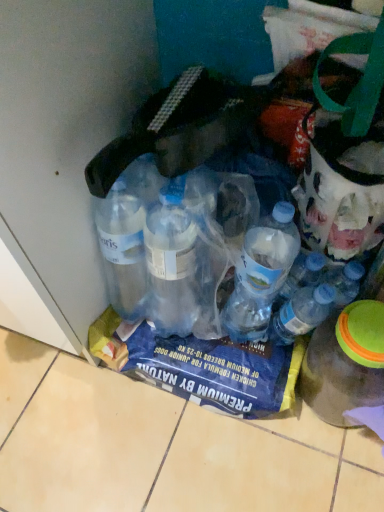
Question: From a real-world perspective, is translucent plastic bottle at center, placed as the 2th bottle when sorted from left to right, under transparent plastic bottle at lower right, which is the 1th bottle from right to left?

Choices:
 (A) yes
 (B) no

Answer: (B)

Question: Is transparent plastic bottle at lower right, arranged as the 3th bottle when viewed from the left, completely or partially inside translucent plastic bottle at center, which is counted as the second bottle, starting from the right?

Choices:
 (A) no
 (B) yes

Answer: (A)

Question: Is translucent plastic bottle at center, placed as the 2th bottle when sorted from left to right, smaller than transparent plastic bottle at lower right, which is the 1th bottle from right to left?

Choices:
 (A) no
 (B) yes

Answer: (B)

Question: Does translucent plastic bottle at center, which is counted as the second bottle, starting from the right, have a greater width compared to transparent plastic bottle at lower right, which is the 1th bottle from right to left?

Choices:
 (A) yes
 (B) no

Answer: (B)

Question: Considering the relative sizes of translucent plastic bottle at center, placed as the 2th bottle when sorted from left to right, and transparent plastic bottle at lower right, which is the 1th bottle from right to left, in the image provided, is translucent plastic bottle at center, placed as the 2th bottle when sorted from left to right, thinner than transparent plastic bottle at lower right, which is the 1th bottle from right to left,?

Choices:
 (A) yes
 (B) no

Answer: (A)

Question: From a real-world perspective, is transparent plastic bottle at lower right, arranged as the 3th bottle when viewed from the left, above or below transparent plastic bottles at lower left, the third bottle positioned from the right?

Choices:
 (A) below
 (B) above

Answer: (A)

Question: Is transparent plastic bottle at lower right, which is the 1th bottle from right to left, spatially inside transparent plastic bottles at lower left, the 1th bottle when ordered from left to right, or outside of it?

Choices:
 (A) outside
 (B) inside

Answer: (A)

Question: Considering the positions of point (319, 329) and point (233, 183), is point (319, 329) closer or farther from the camera than point (233, 183)?

Choices:
 (A) closer
 (B) farther

Answer: (A)

Question: Considering the positions of transparent plastic bottle at lower right, arranged as the 3th bottle when viewed from the left, and transparent plastic bottles at lower left, the third bottle positioned from the right, in the image, is transparent plastic bottle at lower right, arranged as the 3th bottle when viewed from the left, bigger or smaller than transparent plastic bottles at lower left, the third bottle positioned from the right,?

Choices:
 (A) small
 (B) big

Answer: (A)

Question: Considering the relative positions of transparent plastic bottles at lower left, the third bottle positioned from the right, and translucent plastic bottle at center, which is counted as the second bottle, starting from the right, in the image provided, is transparent plastic bottles at lower left, the third bottle positioned from the right, to the left or to the right of translucent plastic bottle at center, which is counted as the second bottle, starting from the right,?

Choices:
 (A) right
 (B) left

Answer: (B)

Question: From the image's perspective, is transparent plastic bottles at lower left, the third bottle positioned from the right, positioned above or below translucent plastic bottle at center, placed as the 2th bottle when sorted from left to right?

Choices:
 (A) above
 (B) below

Answer: (A)

Question: Choose the correct answer: Is transparent plastic bottles at lower left, the third bottle positioned from the right, inside translucent plastic bottle at center, which is counted as the second bottle, starting from the right, or outside it?

Choices:
 (A) inside
 (B) outside

Answer: (B)

Question: From their relative heights in the image, would you say transparent plastic bottles at lower left, the 1th bottle when ordered from left to right, is taller or shorter than translucent plastic bottle at center, placed as the 2th bottle when sorted from left to right?

Choices:
 (A) tall
 (B) short

Answer: (A)

Question: Relative to transparent plastic bottle at lower right, which is the 1th bottle from right to left, is transparent plastic bottles at lower left, the 1th bottle when ordered from left to right, in front or behind?

Choices:
 (A) front
 (B) behind

Answer: (A)

Question: Looking at the image, does transparent plastic bottles at lower left, the third bottle positioned from the right, seem bigger or smaller compared to transparent plastic bottle at lower right, arranged as the 3th bottle when viewed from the left?

Choices:
 (A) big
 (B) small

Answer: (A)